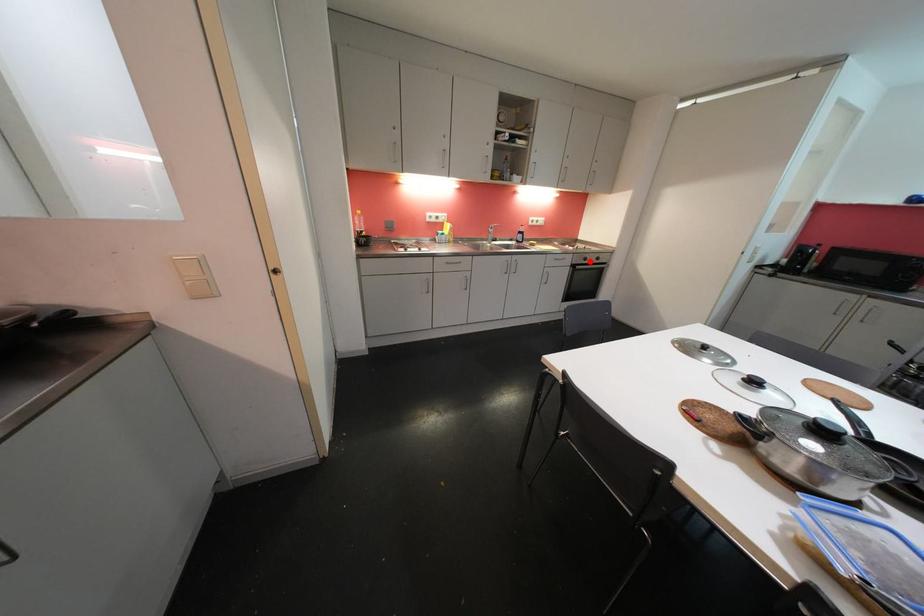
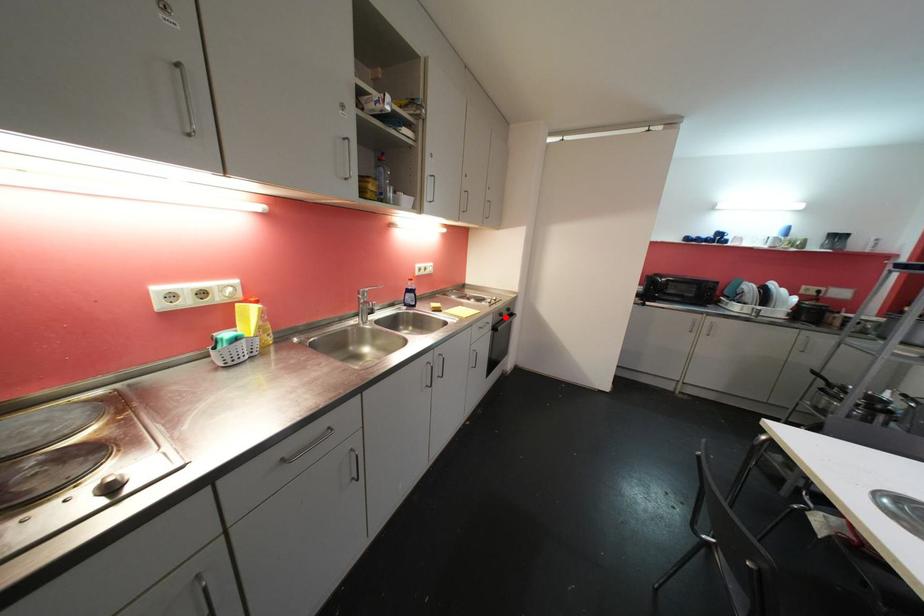
I am providing you with two images of the same scene from different viewpoints. A red point is marked on the first image and another point is marked on the second image. Is the marked point in image1 the same physical position as the marked point in image2?

Yes